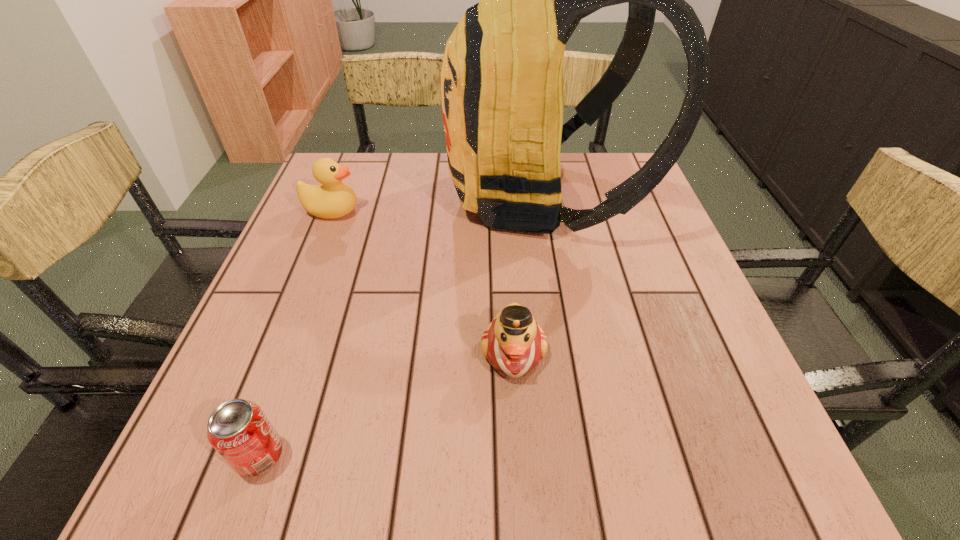
Image resolution: width=960 pixels, height=540 pixels. Identify the location of free space between the second nearest object and the soda can. (387, 403).

I want to click on unoccupied position between the nearer duck and the left duck, so click(422, 281).

Find the location of a particular element. The width and height of the screenshot is (960, 540). vacant space that is in between the farther duck and the backpack is located at coordinates (437, 204).

The width and height of the screenshot is (960, 540). In order to click on vacant area that lies between the soda can and the backpack in this screenshot , I will do `click(400, 327)`.

In order to click on empty location between the tallest object and the left duck in this screenshot , I will do `click(437, 204)`.

Image resolution: width=960 pixels, height=540 pixels. What are the coordinates of `object that is the third nearest to the backpack` in the screenshot? It's located at click(x=238, y=429).

Locate an element on the screen. The width and height of the screenshot is (960, 540). object that is the nearest to the farther duck is located at coordinates (502, 74).

Where is `vacant region that satisfies the following two spatial constraints: 1. on the back side of the nearest object; 2. at the beak of the farther duck`? Image resolution: width=960 pixels, height=540 pixels. vacant region that satisfies the following two spatial constraints: 1. on the back side of the nearest object; 2. at the beak of the farther duck is located at coordinates (347, 211).

Locate an element on the screen. This screenshot has width=960, height=540. free point that satisfies the following two spatial constraints: 1. on the front-facing side of the tallest object; 2. on the face of the nearer duck is located at coordinates (567, 352).

At what (x,y) coordinates should I click in order to perform the action: click on free location that satisfies the following two spatial constraints: 1. on the back side of the soda can; 2. at the beak of the farther duck. Please return your answer as a coordinate pair (x, y). This screenshot has width=960, height=540. Looking at the image, I should click on (347, 211).